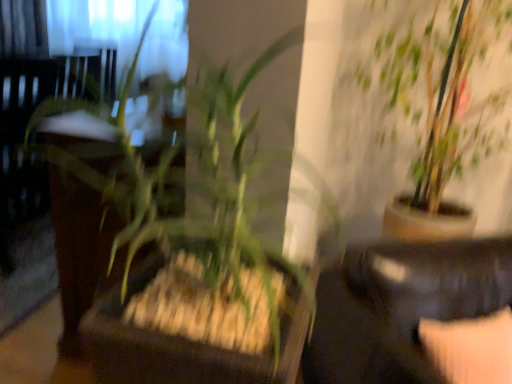
Locate an element on the screen. The width and height of the screenshot is (512, 384). velvet beige pillow at lower right is located at coordinates (470, 348).

At what (x,y) coordinates should I click in order to perform the action: click on black leather couch at lower right. Please return your answer as a coordinate pair (x, y). This screenshot has height=384, width=512. Looking at the image, I should click on (400, 306).

Image resolution: width=512 pixels, height=384 pixels. What do you see at coordinates (400, 306) in the screenshot?
I see `black leather couch at lower right` at bounding box center [400, 306].

Locate an element on the screen. This screenshot has height=384, width=512. green leafy plant at upper right, acting as the first houseplant starting from the right is located at coordinates (435, 87).

Would you consider black leather couch at lower right to be distant from velvet beige pillow at lower right?

Actually, black leather couch at lower right and velvet beige pillow at lower right are a little close together.

Considering the relative sizes of black leather couch at lower right and velvet beige pillow at lower right in the image provided, is black leather couch at lower right taller than velvet beige pillow at lower right?

Indeed, black leather couch at lower right has a greater height compared to velvet beige pillow at lower right.

Which object is thinner, black leather couch at lower right or velvet beige pillow at lower right?

With smaller width is velvet beige pillow at lower right.

Looking at this image, does black leather couch at lower right have a larger size compared to velvet beige pillow at lower right?

Yes, black leather couch at lower right is bigger than velvet beige pillow at lower right.

Considering the sizes of objects green leafy plant at upper right, the 1th houseplant positioned from the back, and black leather couch at lower right in the image provided, who is bigger, green leafy plant at upper right, the 1th houseplant positioned from the back, or black leather couch at lower right?

Bigger between the two is green leafy plant at upper right, the 1th houseplant positioned from the back.

Is point (397, 65) more distant than point (387, 353)?

Yes, point (397, 65) is farther from viewer.

How distant is green leafy plant at upper right, acting as the first houseplant starting from the right, from black leather couch at lower right?

green leafy plant at upper right, acting as the first houseplant starting from the right, is 32.12 inches away from black leather couch at lower right.

Which object is wider, green leafy plant at upper right, the second houseplant in the front-to-back sequence, or black leather couch at lower right?

green leafy plant at upper right, the second houseplant in the front-to-back sequence.

Is velvet beige pillow at lower right placed right next to green leafy plant at center, positioned as the 1th houseplant in left-to-right order?

No, velvet beige pillow at lower right is not touching green leafy plant at center, positioned as the 1th houseplant in left-to-right order.

Does velvet beige pillow at lower right have a greater height compared to green leafy plant at center, the 2th houseplant viewed from the right?

No.

From the image's perspective, is velvet beige pillow at lower right positioned above or below green leafy plant at center, the 2th houseplant viewed from the right?

velvet beige pillow at lower right is situated lower than green leafy plant at center, the 2th houseplant viewed from the right, in the image.

Does green leafy plant at center, positioned as the 1th houseplant in left-to-right order, have a larger size compared to velvet beige pillow at lower right?

Indeed, green leafy plant at center, positioned as the 1th houseplant in left-to-right order, has a larger size compared to velvet beige pillow at lower right.

Based on the photo, how far apart are green leafy plant at center, which appears as the 2th houseplant when viewed from the back, and velvet beige pillow at lower right?

61.82 centimeters.

Locate an element on the screen. This screenshot has height=384, width=512. pillow that is on the right side of green leafy plant at center, the 2th houseplant viewed from the right is located at coordinates (470, 348).

Is green leafy plant at center, the 1th houseplant positioned from the front, inside or outside of black leather couch at lower right?

green leafy plant at center, the 1th houseplant positioned from the front, is spatially situated outside black leather couch at lower right.

Consider the image. Who is smaller, green leafy plant at center, which appears as the 2th houseplant when viewed from the back, or black leather couch at lower right?

green leafy plant at center, which appears as the 2th houseplant when viewed from the back.

How far apart are green leafy plant at center, positioned as the 1th houseplant in left-to-right order, and black leather couch at lower right?

green leafy plant at center, positioned as the 1th houseplant in left-to-right order, and black leather couch at lower right are 38.73 centimeters apart.

Is green leafy plant at center, which appears as the 2th houseplant when viewed from the back, wider or thinner than black leather couch at lower right?

Clearly, green leafy plant at center, which appears as the 2th houseplant when viewed from the back, has less width compared to black leather couch at lower right.

Does velvet beige pillow at lower right have a smaller size compared to green leafy plant at upper right, the second houseplant in the front-to-back sequence?

Correct, velvet beige pillow at lower right occupies less space than green leafy plant at upper right, the second houseplant in the front-to-back sequence.

Is velvet beige pillow at lower right beside green leafy plant at upper right, the second houseplant in the front-to-back sequence?

They are not placed beside each other.

Measure the distance from velvet beige pillow at lower right to green leafy plant at upper right, the second houseplant in the front-to-back sequence.

3.51 feet.

Looking at this image, from a real-world perspective, is velvet beige pillow at lower right on green leafy plant at upper right, which is the 2th houseplant from left to right?

No, from a real-world perspective, velvet beige pillow at lower right is not above green leafy plant at upper right, which is the 2th houseplant from left to right.

You are a GUI agent. You are given a task and a screenshot of the screen. Output one action in this format:
    pyautogui.click(x=<x>, y=<y>)
    Task: Click on the 2nd houseplant above when counting from the black leather couch at lower right (from the image's perspective)
    
    Given the screenshot: What is the action you would take?
    pyautogui.click(x=435, y=87)

Is black leather couch at lower right taller or shorter than green leafy plant at upper right, the 1th houseplant positioned from the back?

In the image, black leather couch at lower right appears to be shorter than green leafy plant at upper right, the 1th houseplant positioned from the back.

From the picture: Considering the sizes of objects black leather couch at lower right and green leafy plant at upper right, the 1th houseplant positioned from the back, in the image provided, who is thinner, black leather couch at lower right or green leafy plant at upper right, the 1th houseplant positioned from the back,?

Thinner between the two is black leather couch at lower right.

Locate an element on the screen. This screenshot has height=384, width=512. pillow above the black leather couch at lower right (from a real-world perspective) is located at coordinates (470, 348).

Find the location of a particular element. The width and height of the screenshot is (512, 384). houseplant that appears on the right of black leather couch at lower right is located at coordinates (435, 87).

From the image, which object appears to be farther from black leather couch at lower right, green leafy plant at center, positioned as the 1th houseplant in left-to-right order, or velvet beige pillow at lower right?

green leafy plant at center, positioned as the 1th houseplant in left-to-right order.

Estimate the real-world distances between objects in this image. Which object is further from black leather couch at lower right, green leafy plant at upper right, acting as the first houseplant starting from the right, or velvet beige pillow at lower right?

The object further to black leather couch at lower right is green leafy plant at upper right, acting as the first houseplant starting from the right.

Which object lies further to the anchor point black leather couch at lower right, velvet beige pillow at lower right or green leafy plant at center, the 2th houseplant viewed from the right?

green leafy plant at center, the 2th houseplant viewed from the right, lies further to black leather couch at lower right than the other object.

Considering their positions, is green leafy plant at center, the 1th houseplant positioned from the front, positioned further to velvet beige pillow at lower right than green leafy plant at upper right, acting as the first houseplant starting from the right?

green leafy plant at upper right, acting as the first houseplant starting from the right, lies further to velvet beige pillow at lower right than the other object.

Looking at the image, which one is located further to green leafy plant at upper right, the second houseplant in the front-to-back sequence, black leather couch at lower right or green leafy plant at center, the 1th houseplant positioned from the front?

black leather couch at lower right is further to green leafy plant at upper right, the second houseplant in the front-to-back sequence.

Looking at the image, which one is located closer to green leafy plant at center, the 1th houseplant positioned from the front, black leather couch at lower right or green leafy plant at upper right, the 1th houseplant positioned from the back?

Based on the image, black leather couch at lower right appears to be nearer to green leafy plant at center, the 1th houseplant positioned from the front.

When comparing their distances from green leafy plant at upper right, which is the 2th houseplant from left to right, does green leafy plant at center, which appears as the 2th houseplant when viewed from the back, or black leather couch at lower right seem closer?

green leafy plant at center, which appears as the 2th houseplant when viewed from the back, lies closer to green leafy plant at upper right, which is the 2th houseplant from left to right, than the other object.

Estimate the real-world distances between objects in this image. Which object is closer to green leafy plant at center, the 1th houseplant positioned from the front, velvet beige pillow at lower right or green leafy plant at upper right, which is the 2th houseplant from left to right?

velvet beige pillow at lower right.

Identify the location of pillow between green leafy plant at center, the 1th houseplant positioned from the front, and green leafy plant at upper right, acting as the first houseplant starting from the right, in the horizontal direction. (470, 348).

Where is `pillow between green leafy plant at center, which appears as the 2th houseplant when viewed from the back, and black leather couch at lower right, in the horizontal direction`? pillow between green leafy plant at center, which appears as the 2th houseplant when viewed from the back, and black leather couch at lower right, in the horizontal direction is located at coordinates (470, 348).

Locate an element on the screen. pillow between green leafy plant at upper right, the second houseplant in the front-to-back sequence, and black leather couch at lower right vertically is located at coordinates (470, 348).

The height and width of the screenshot is (384, 512). Find the location of `rocking chair situated between green leafy plant at center, which appears as the 2th houseplant when viewed from the back, and green leafy plant at upper right, the second houseplant in the front-to-back sequence, from left to right`. rocking chair situated between green leafy plant at center, which appears as the 2th houseplant when viewed from the back, and green leafy plant at upper right, the second houseplant in the front-to-back sequence, from left to right is located at coordinates (400, 306).